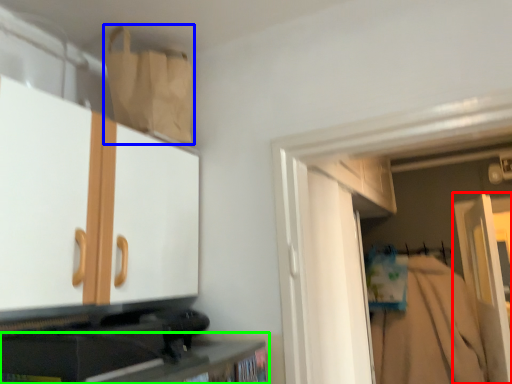
Question: Based on their relative distances, which object is nearer to door (highlighted by a red box)? Choose from paper bag (highlighted by a blue box) and cabinetry (highlighted by a green box).

Choices:
 (A) paper bag
 (B) cabinetry

Answer: (B)